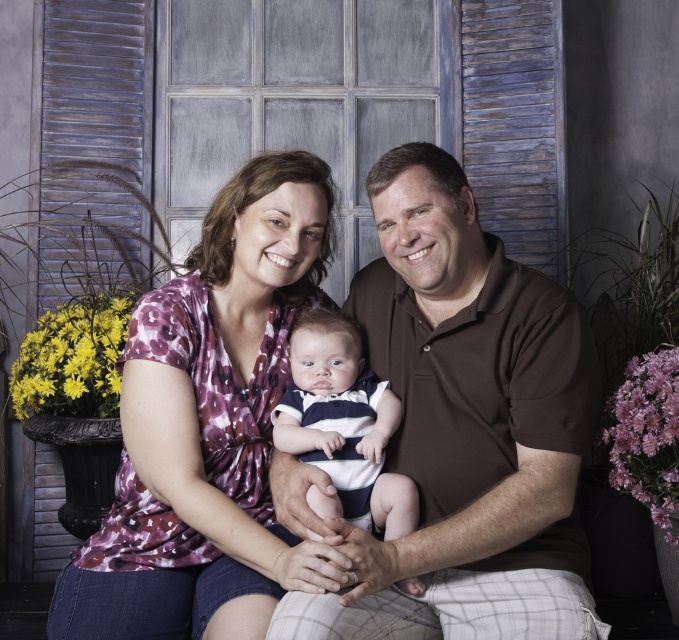
You are a tailor who needs to determine which shirt requires more fabric to make between the brown smooth shirt at center and the striped cotton shirt at center. Based on the image, which one would need more fabric?

The brown smooth shirt at center is larger in size than the striped cotton shirt at center, so it would require more fabric to make.